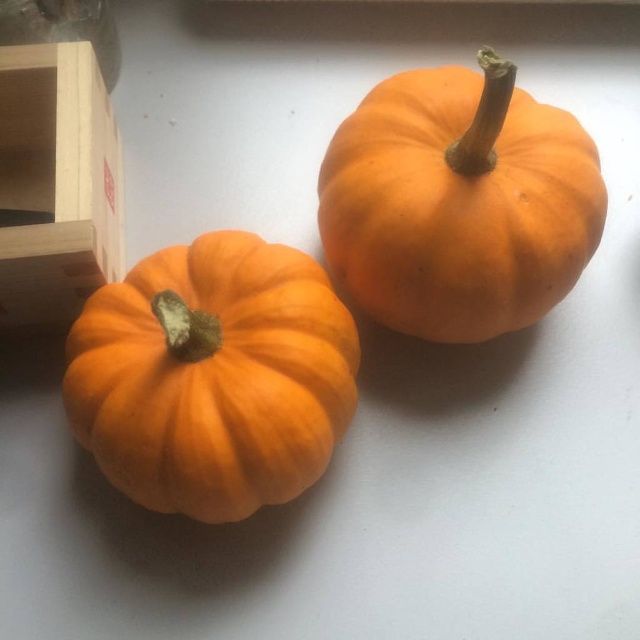
This screenshot has width=640, height=640. Describe the element at coordinates (212, 376) in the screenshot. I see `orange matte pumpkin at lower left` at that location.

At what (x,y) coordinates should I click in order to perform the action: click on orange matte pumpkin at lower left. Please return your answer as a coordinate pair (x, y). Looking at the image, I should click on (212, 376).